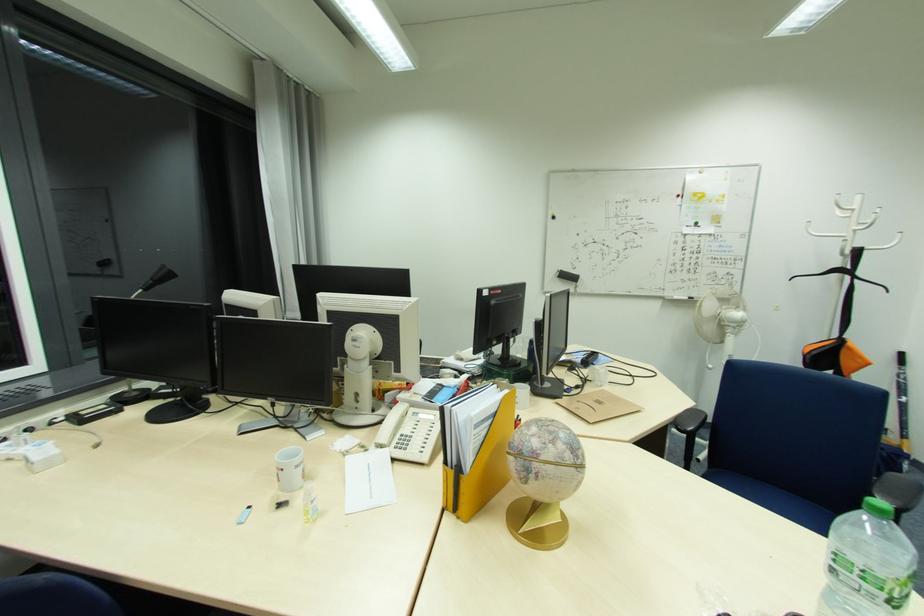
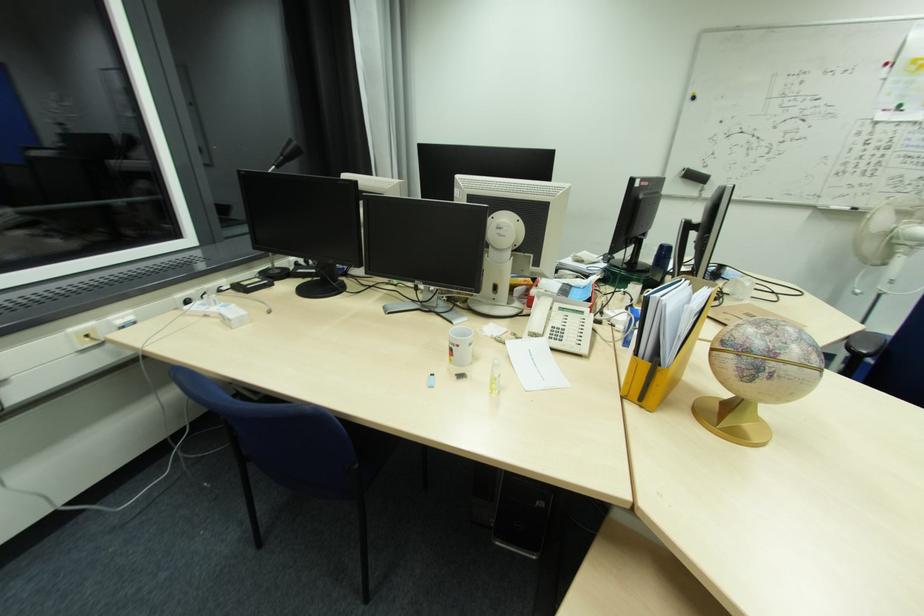
Question: Based on the continuous images, in which direction is the camera rotating? Reply with the corresponding letter.

Choices:
 (A) Left
 (B) Right
 (C) Up
 (D) Down

Answer: (D)